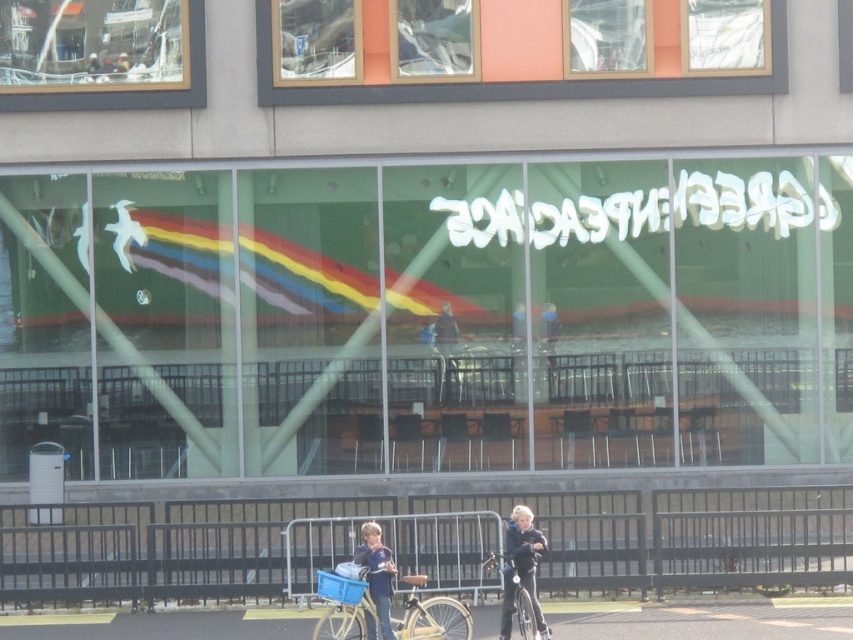
Between green glass shop window at center and matte blue bicycle at center, which one is positioned higher?

green glass shop window at center is above.

What do you see at coordinates (450, 314) in the screenshot?
I see `green glass shop window at center` at bounding box center [450, 314].

Which is behind, point (97, 291) or point (328, 577)?

Positioned behind is point (97, 291).

Where is `green glass shop window at center`? The width and height of the screenshot is (853, 640). green glass shop window at center is located at coordinates (450, 314).

Between matte blue bicycle at center and metallic silver bicycle at center, which one has less height?

With less height is matte blue bicycle at center.

Is matte blue bicycle at center to the right of metallic silver bicycle at center from the viewer's perspective?

Incorrect, matte blue bicycle at center is not on the right side of metallic silver bicycle at center.

Who is more forward, (469, 621) or (531, 616)?

Point (469, 621)

Where is `matte blue bicycle at center`? The image size is (853, 640). matte blue bicycle at center is located at coordinates (387, 609).

Who is positioned more to the left, green glass shop window at center or metallic silver bicycle at center?

From the viewer's perspective, metallic silver bicycle at center appears more on the left side.

Is green glass shop window at center taller than metallic silver bicycle at center?

Indeed, green glass shop window at center has a greater height compared to metallic silver bicycle at center.

The width and height of the screenshot is (853, 640). In order to click on green glass shop window at center in this screenshot , I will do `click(450, 314)`.

I want to click on green glass shop window at center, so click(x=450, y=314).